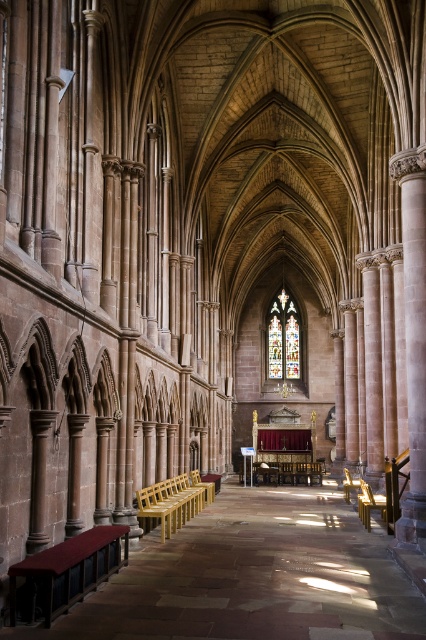
Is golden polished wood bench at lower left above stained glass at center?

Actually, golden polished wood bench at lower left is below stained glass at center.

What do you see at coordinates (172, 502) in the screenshot? The image size is (426, 640). I see `golden polished wood bench at lower left` at bounding box center [172, 502].

At what (x,y) coordinates should I click in order to perform the action: click on golden polished wood bench at lower left. Please return your answer as a coordinate pair (x, y). The height and width of the screenshot is (640, 426). Looking at the image, I should click on click(172, 502).